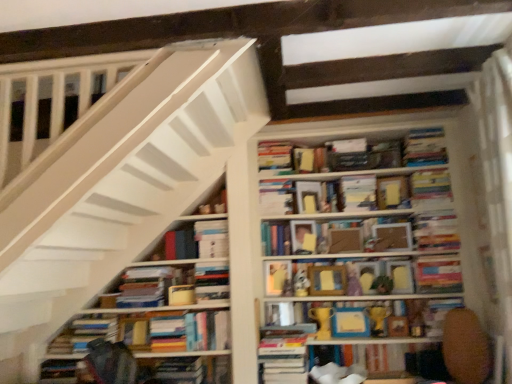
Question: Relative to white paper at center, marked as the 3th paperback book in a left-to-right arrangement, is hardcover book at lower right, which ranks as the fourth book in right-to-left order, in front or behind?

Choices:
 (A) front
 (B) behind

Answer: (A)

Question: Is hardcover book at lower right, arranged as the 10th book when viewed from the left, taller or shorter than white paper at center, the eleventh paperback book viewed from the right?

Choices:
 (A) short
 (B) tall

Answer: (A)

Question: Considering the real-world distances, which object is closest to the hardcover books at lower left, arranged as the 1th book when viewed from the left?

Choices:
 (A) hardcover book at center, marked as the 3th book in a left-to-right arrangement
 (B) white wooden bookcase at upper center
 (C) plush white bear at center, which ranks as the first toy in left-to-right order
 (D) matte yellow paperback book at center, the 10th paperback book positioned from the right
 (E) hardcover book at center, the 9th paperback book viewed from the left

Answer: (A)

Question: Which is nearer to the hardcover book at center, which is the sixth paperback book in left-to-right order?

Choices:
 (A) hardcover book at center, the 12th book in the left-to-right sequence
 (B) plush white bear at center, which ranks as the first toy in left-to-right order
 (C) wooden toy at center, the fourth toy from the left
 (D) yellow matte trophy at center, the 6th book when ordered from right to left
 (E) hardcover books at center, the 5th book when ordered from left to right

Answer: (B)